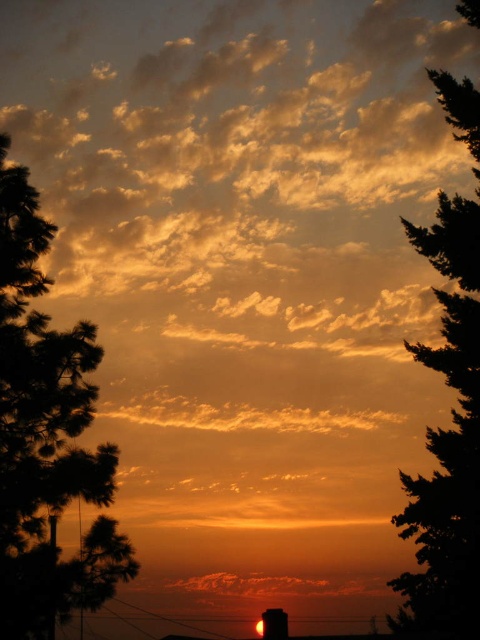
You are standing at the bottom center of the image where the chimney is located. You want to walk to the green leafy tree at left and then to the green leafy tree at right. What is the total distance you will walk?

The green leafy tree at left is 7.56 meters from green leafy tree at right. So, walking from the chimney to the left tree and then to the right tree would require a total distance of 7.56 meters multiplied by 2, totaling 15.12 meters.

You are standing in the middle of the sunset scene and want to walk towards the green leafy tree at left and the green leafy tree at right. Which tree will you reach first?

You will reach the green leafy tree at left first because it is closer to the viewer than the green leafy tree at right.